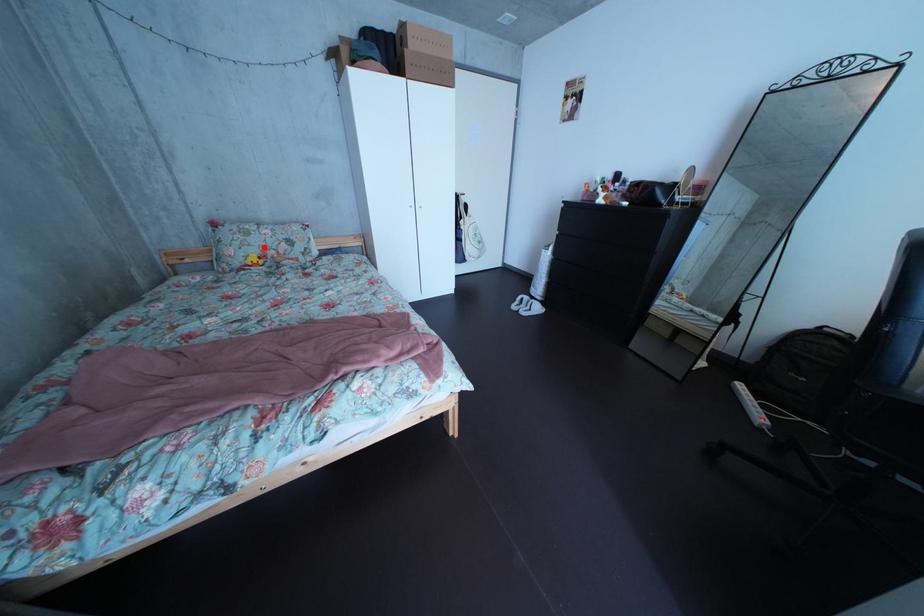
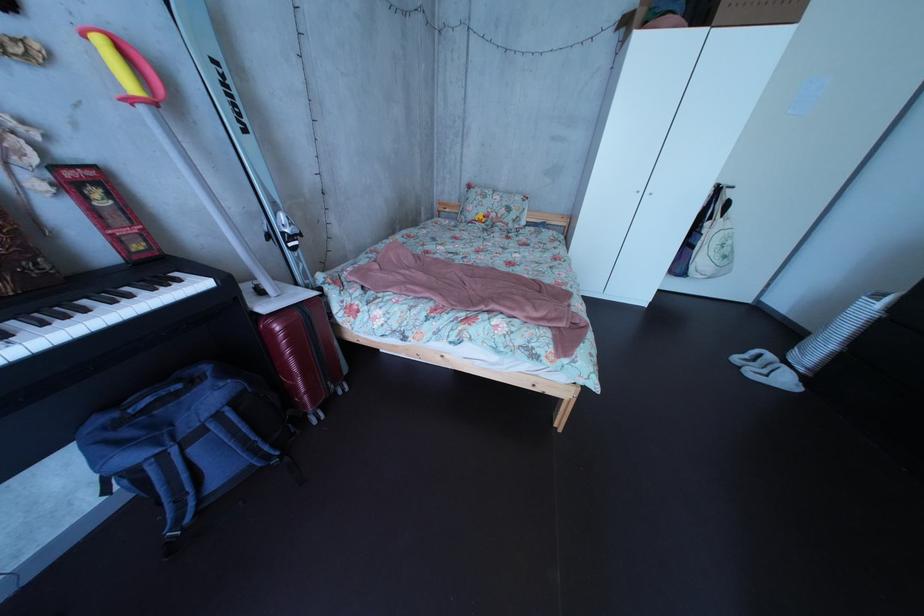
Where in the second image is the point corresponding to the highlighted location from the first image?

(499, 209)